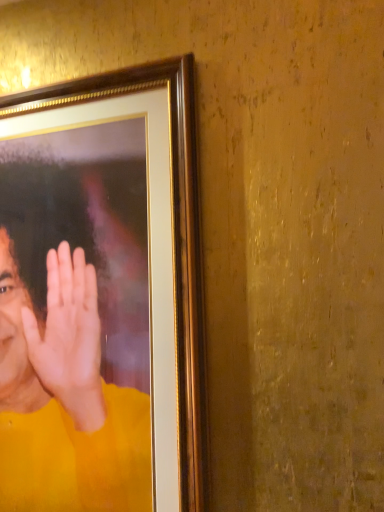
This screenshot has height=512, width=384. What do you see at coordinates (60, 358) in the screenshot?
I see `gold metallic frame at upper left` at bounding box center [60, 358].

Based on the photo, measure the distance between gold metallic frame at upper left and camera.

The depth of gold metallic frame at upper left is 28.86 inches.

Identify the location of gold metallic frame at upper left. click(60, 358).

What is the approximate width of gold metallic frame at upper left?

gold metallic frame at upper left is 1.48 inches in width.

Identify the location of gold metallic frame at upper left. coord(60,358).